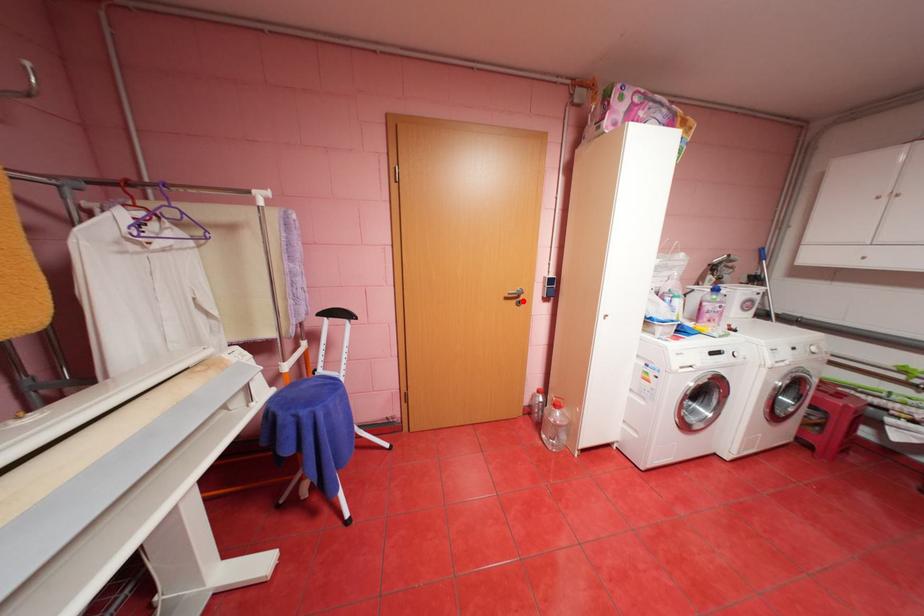
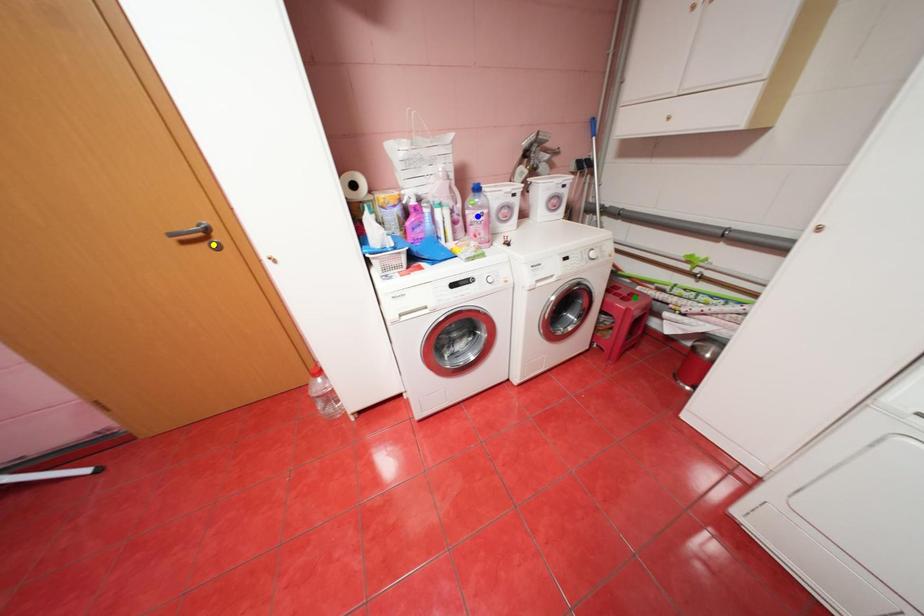
Question: I am providing you with two images of the same scene from different viewpoints. A red point is marked on the first image. You are given multiple points on the second image. Which mark in image 2 goes with the point in image 1?

Choices:
 (A) green point
 (B) blue point
 (C) yellow point

Answer: (C)